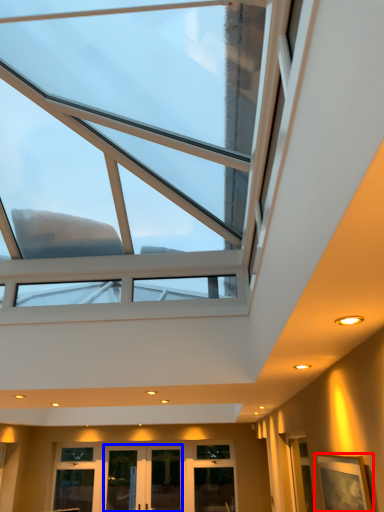
Question: Which object appears farthest to the camera in this image, picture frame (highlighted by a red box) or glass door (highlighted by a blue box)?

Choices:
 (A) picture frame
 (B) glass door

Answer: (B)